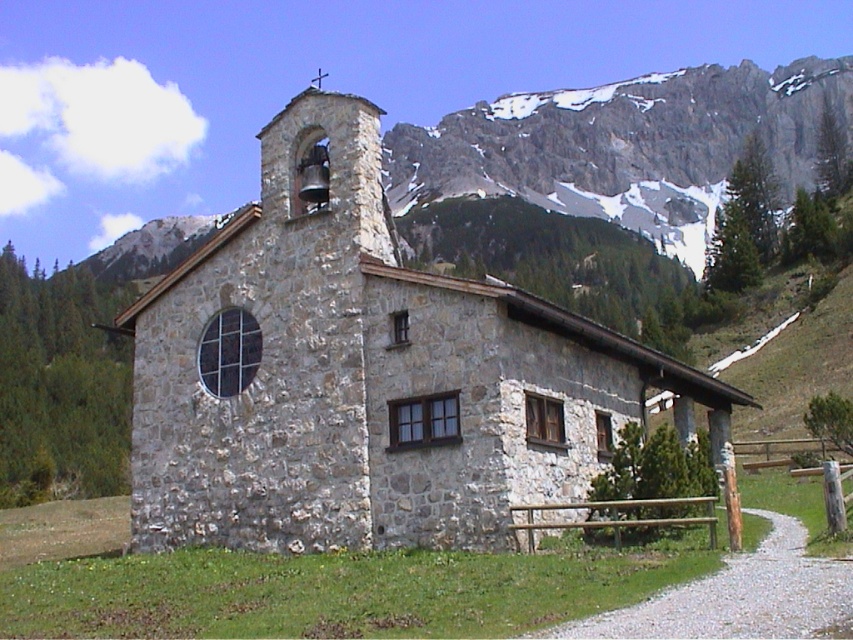
Is stone church at center smaller than gray rocky mountain at upper center?

Indeed, stone church at center has a smaller size compared to gray rocky mountain at upper center.

Is stone church at center positioned behind gray rocky mountain at upper center?

No, stone church at center is in front of gray rocky mountain at upper center.

Does point (235, 477) come closer to viewer compared to point (537, 148)?

Yes, point (235, 477) is closer to viewer.

Where is `stone church at center`? This screenshot has height=640, width=853. stone church at center is located at coordinates pos(368,376).